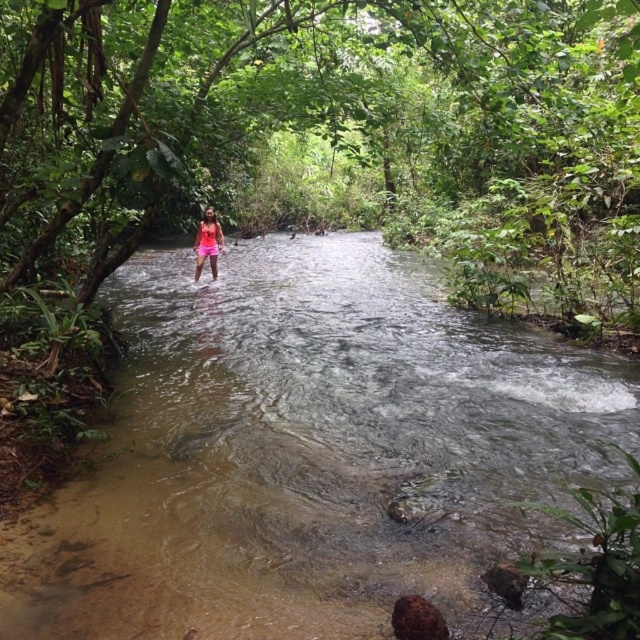
Is clear water stream at center shorter than pink fabric at center?

In fact, clear water stream at center may be taller than pink fabric at center.

Measure the distance between point (317, 346) and camera.

7.86 meters

At what (x,y) coordinates should I click in order to perform the action: click on clear water stream at center. Please return your answer as a coordinate pair (x, y). Looking at the image, I should click on (308, 452).